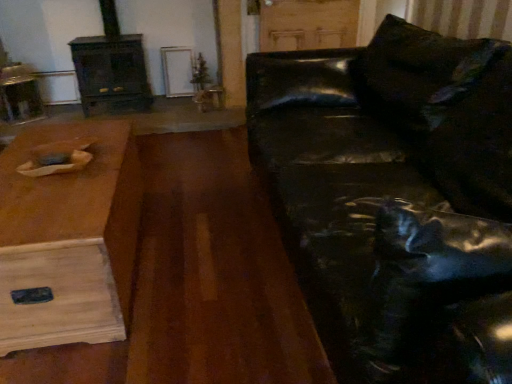
Question: Is shiny black leather couch at right to the left or to the right of wooden table at left in the image?

Choices:
 (A) right
 (B) left

Answer: (A)

Question: Looking at the image, does shiny black leather couch at right seem bigger or smaller compared to wooden table at left?

Choices:
 (A) big
 (B) small

Answer: (A)

Question: Which is nearer to the wooden table at left?

Choices:
 (A) shiny black leather couch at right
 (B) dark wood fireplace at left

Answer: (A)

Question: Which object is positioned farthest from the shiny black leather couch at right?

Choices:
 (A) wooden table at left
 (B) dark wood fireplace at left

Answer: (B)